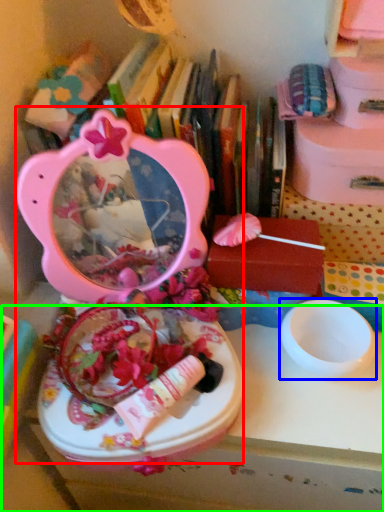
Question: Which object is positioned closest to toy (highlighted by a red box)? Select from bowl (highlighted by a blue box) and table (highlighted by a green box).

Choices:
 (A) bowl
 (B) table

Answer: (B)